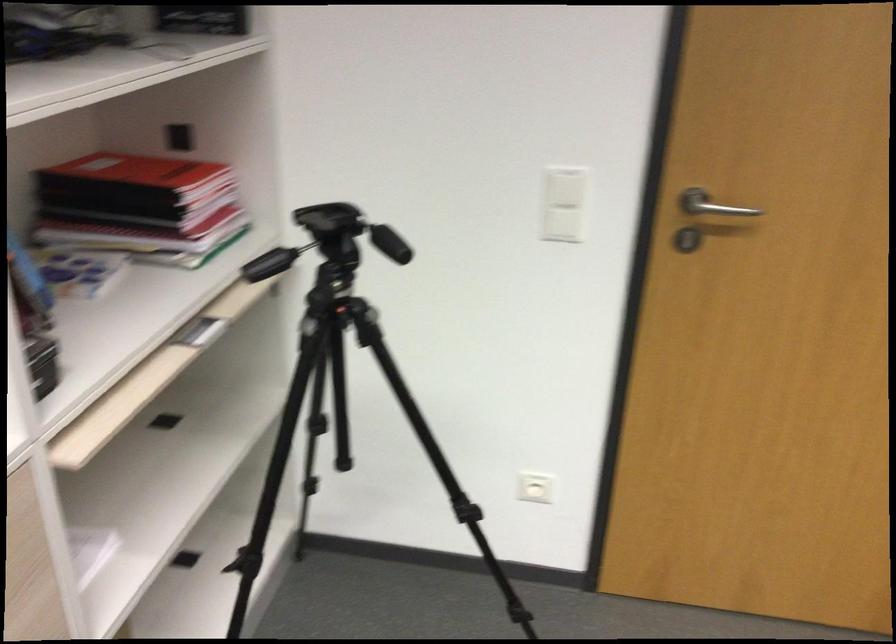
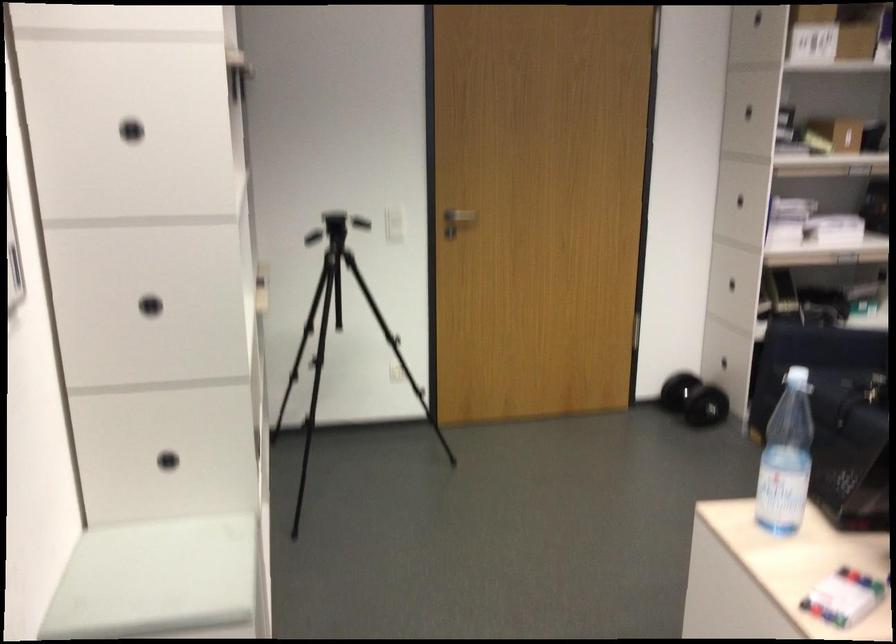
Locate, in the second image, the point that corresponds to (x=616, y=194) in the first image.

(393, 214)